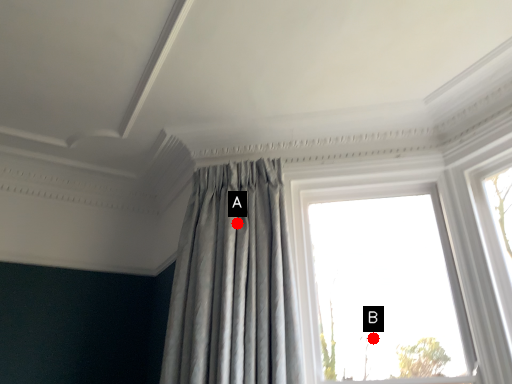
Question: Two points are circled on the image, labeled by A and B beside each circle. Which of the following is the closest to the observer?

Choices:
 (A) A is closer
 (B) B is closer

Answer: (A)